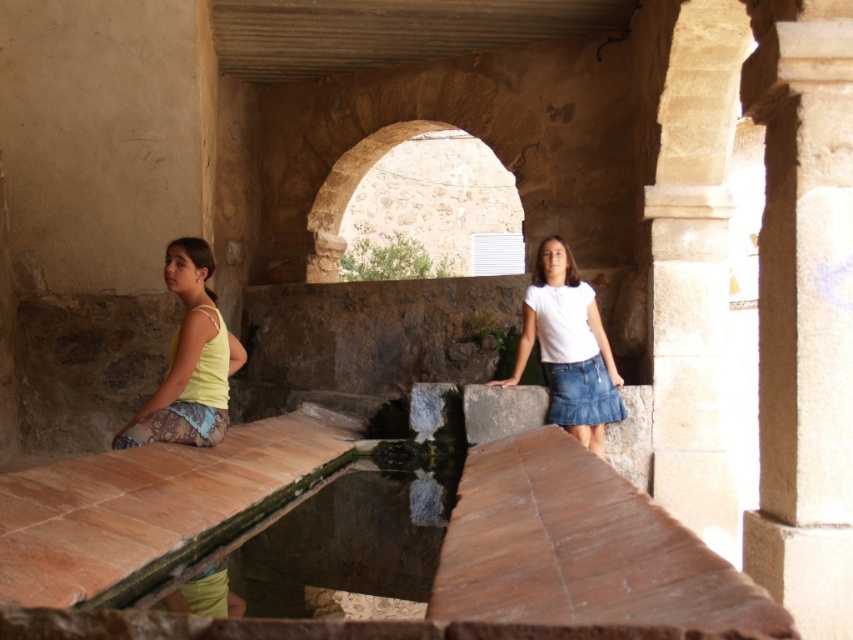
Does yellow fabric skirt at left have a lesser height compared to white denim skirt at center?

Yes.

Locate an element on the screen. yellow fabric skirt at left is located at coordinates (189, 360).

Who is more distant from viewer, (834,314) or (361,227)?

Point (361,227)

Who is lower down, white stone pillar at right or stone textured archway at center?

Positioned lower is white stone pillar at right.

In order to click on white stone pillar at right in this screenshot , I will do `click(804, 310)`.

You are a GUI agent. You are given a task and a screenshot of the screen. Output one action in this format:
    pyautogui.click(x=<x>, y=<y>)
    Task: Click on the white stone pillar at right
    
    Given the screenshot: What is the action you would take?
    pyautogui.click(x=804, y=310)

This screenshot has width=853, height=640. What do you see at coordinates (804, 310) in the screenshot? I see `white stone pillar at right` at bounding box center [804, 310].

Does white stone pillar at right appear on the left side of smooth stone pillar at right?

Indeed, white stone pillar at right is positioned on the left side of smooth stone pillar at right.

What do you see at coordinates (804, 310) in the screenshot? I see `white stone pillar at right` at bounding box center [804, 310].

At what (x,y) coordinates should I click in order to perform the action: click on white stone pillar at right. Please return your answer as a coordinate pair (x, y). This screenshot has height=640, width=853. Looking at the image, I should click on (804, 310).